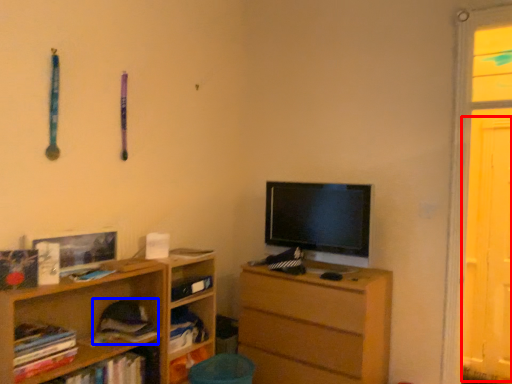
Question: Which object is further to the camera taking this photo, screen door (highlighted by a red box) or book (highlighted by a blue box)?

Choices:
 (A) screen door
 (B) book

Answer: (A)